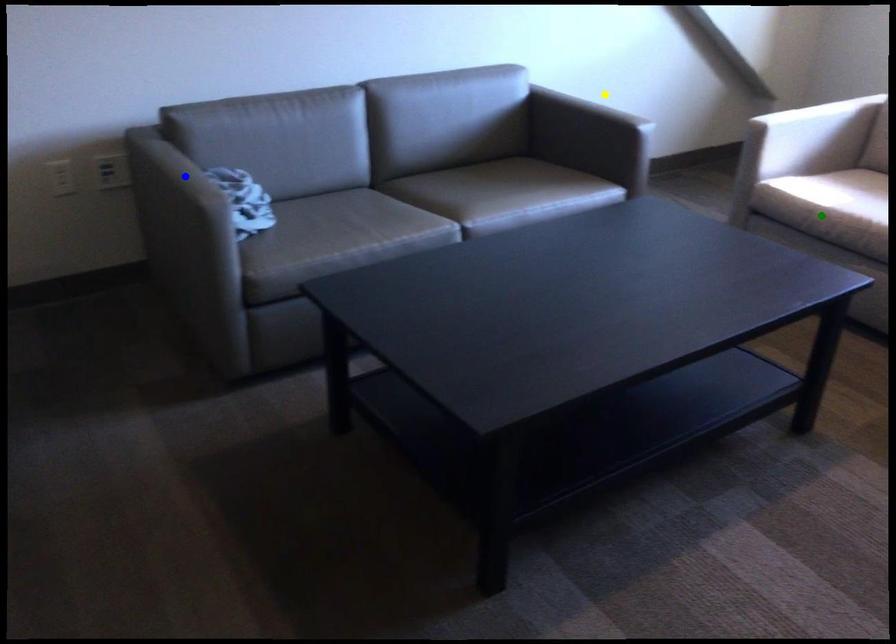
Order these from nearest to farthest:
- green point
- blue point
- yellow point

blue point < green point < yellow point